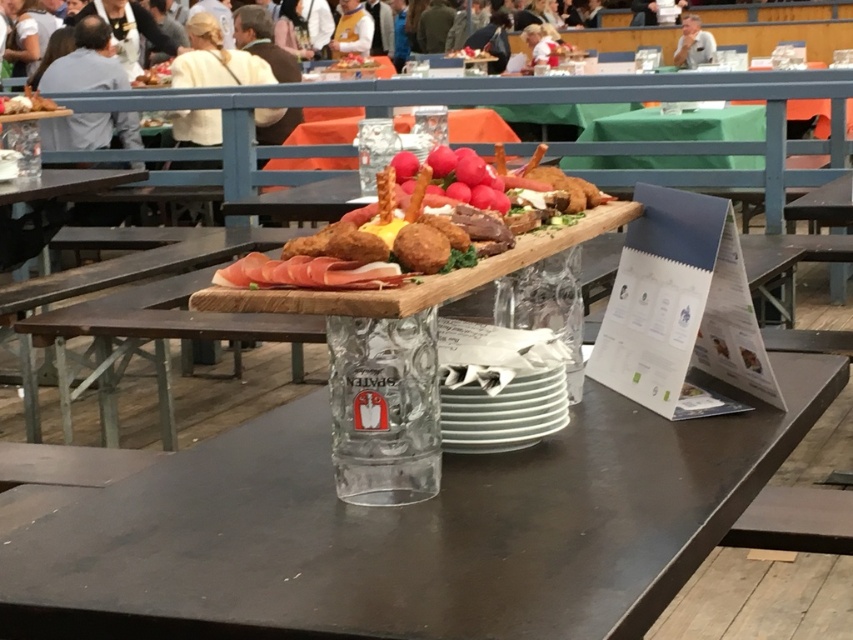
You are at a festival and want to grab a drink from the transparent glass at center and some golden fried croquettes at center. Which item should you reach for first to avoid knocking over the other?

You should reach for the transparent glass at center first because it is in front of the golden fried croquettes at center, so moving it first would prevent accidentally knocking over the croquettes when reaching for the glass.

You are at a festival and want to serve yourself a drink and some snacks. The transparent glass at center and golden fried croquettes at center are both on the table. Which item is larger in size?

The transparent glass at center is bigger than golden fried croquettes at center, so the transparent glass at center is larger in size.

You are at a festival and want to grab a drink and some snacks. You see a transparent glass at center and golden fried croquettes at center. Which one is more to the right?

The transparent glass at center is positioned on the right side of golden fried croquettes at center, so the transparent glass at center is more to the right.